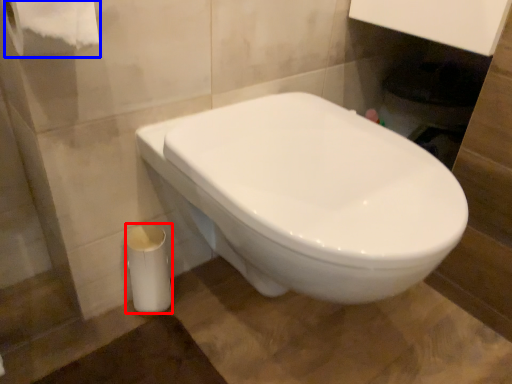
Question: Which object is closer to the camera taking this photo, porcelain (highlighted by a red box) or toilet paper (highlighted by a blue box)?

Choices:
 (A) porcelain
 (B) toilet paper

Answer: (B)